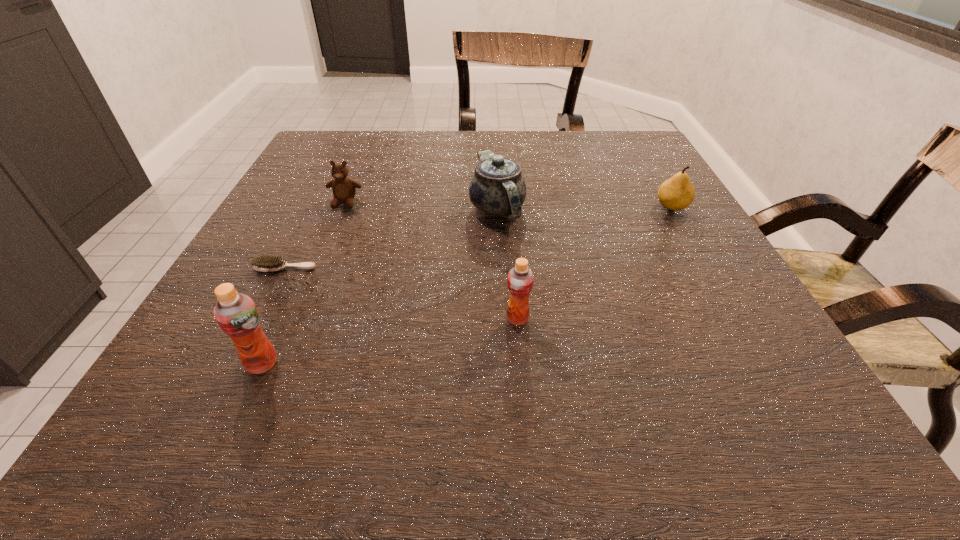
You are a GUI agent. You are given a task and a screenshot of the screen. Output one action in this format:
    pyautogui.click(x=<x>, y=<y>)
    Task: Click on the vacant place for an extra orange juice on the right
    
    Given the screenshot: What is the action you would take?
    pyautogui.click(x=730, y=281)